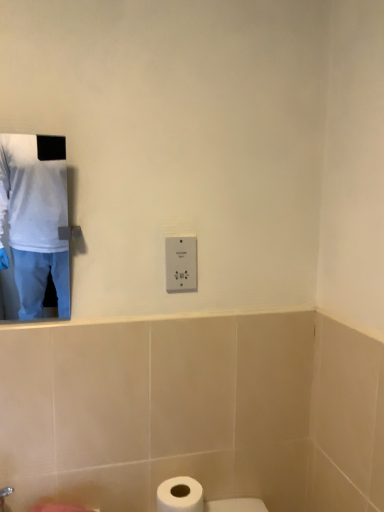
Question: Considering the relative positions of white plastic switch at center and white matte toilet paper at lower center in the image provided, is white plastic switch at center to the left of white matte toilet paper at lower center from the viewer's perspective?

Choices:
 (A) yes
 (B) no

Answer: (B)

Question: Is white plastic switch at center in front of white matte toilet paper at lower center?

Choices:
 (A) yes
 (B) no

Answer: (B)

Question: Is white plastic switch at center outside of white matte toilet paper at lower center?

Choices:
 (A) yes
 (B) no

Answer: (A)

Question: From a real-world perspective, is white plastic switch at center beneath white matte toilet paper at lower center?

Choices:
 (A) yes
 (B) no

Answer: (B)

Question: From the image's perspective, is white plastic switch at center located above white matte toilet paper at lower center?

Choices:
 (A) yes
 (B) no

Answer: (A)

Question: Is white plastic switch at center thinner than white matte toilet paper at lower center?

Choices:
 (A) no
 (B) yes

Answer: (B)

Question: Is white matte shirt at upper left oriented towards white plastic switch at center?

Choices:
 (A) no
 (B) yes

Answer: (A)

Question: Is white matte shirt at upper left far from white plastic switch at center?

Choices:
 (A) yes
 (B) no

Answer: (A)

Question: Is white matte shirt at upper left next to white plastic switch at center and touching it?

Choices:
 (A) no
 (B) yes

Answer: (A)

Question: Considering the relative sizes of white matte shirt at upper left and white plastic switch at center in the image provided, is white matte shirt at upper left smaller than white plastic switch at center?

Choices:
 (A) yes
 (B) no

Answer: (B)

Question: Is white plastic switch at center completely or partially inside white matte shirt at upper left?

Choices:
 (A) yes
 (B) no

Answer: (B)

Question: Is white matte shirt at upper left at the right side of white plastic switch at center?

Choices:
 (A) yes
 (B) no

Answer: (B)

Question: From the image's perspective, is white plastic switch at center beneath white matte shirt at upper left?

Choices:
 (A) yes
 (B) no

Answer: (A)